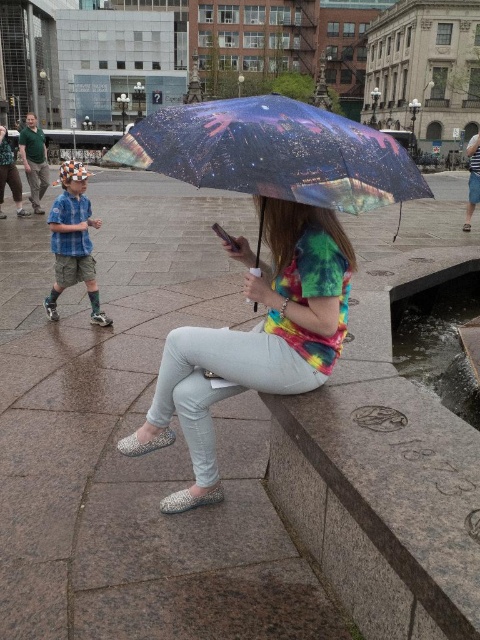
You are a delivery person with a 1.5 meter wide cart. You need to navigate through the plaza to deliver a package to the person under the transparent printed umbrella at center. There is a matte blue shirt at left in your path. Can your cart pass between them without hitting either?

The distance between the transparent printed umbrella at center and the matte blue shirt at left is 2.07 meters. Since your cart is 1.5 meters wide, there is enough space for it to pass between them safely.

Based on the coordinates provided, what object is located at point (x=254, y=340) in the image?

The rainbow tie dye shirt at center is located at point (x=254, y=340).